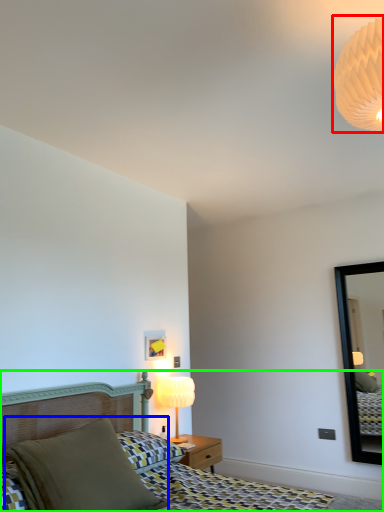
Question: Considering the real-world distances, which object is farthest from lamp (highlighted by a red box)? pillow (highlighted by a blue box) or bed (highlighted by a green box)?

Choices:
 (A) pillow
 (B) bed

Answer: (B)